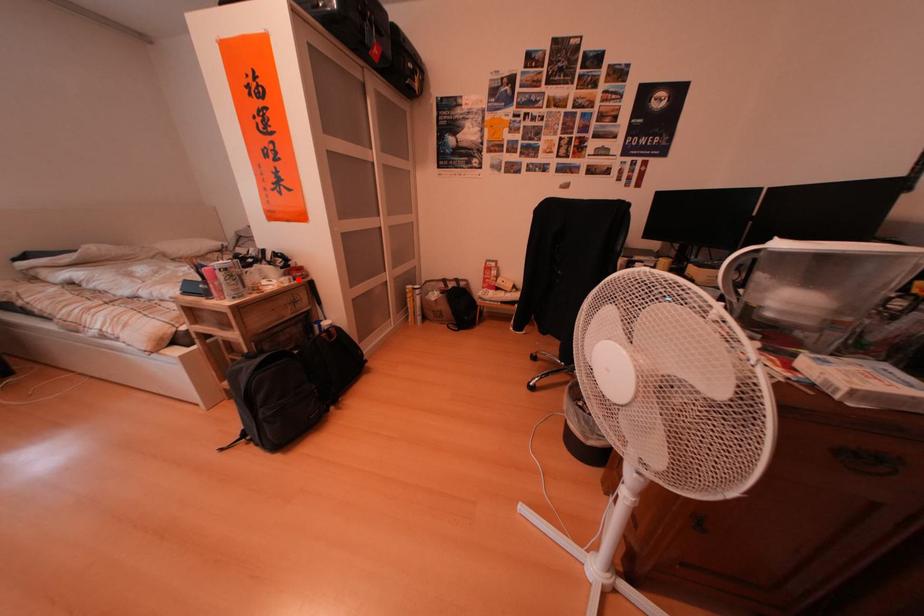
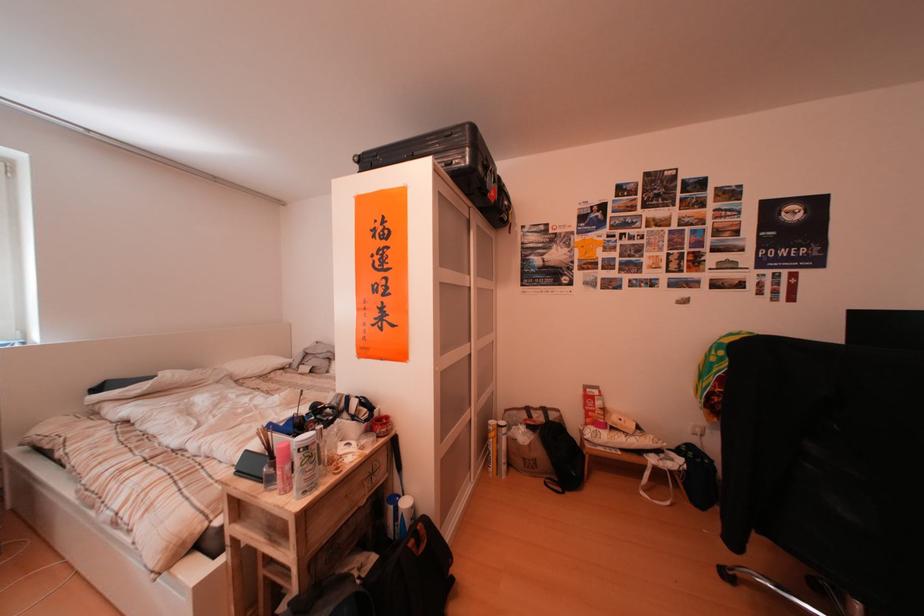
The point at the highlighted location is marked in the first image. Where is the corresponding point in the second image?

(381, 436)